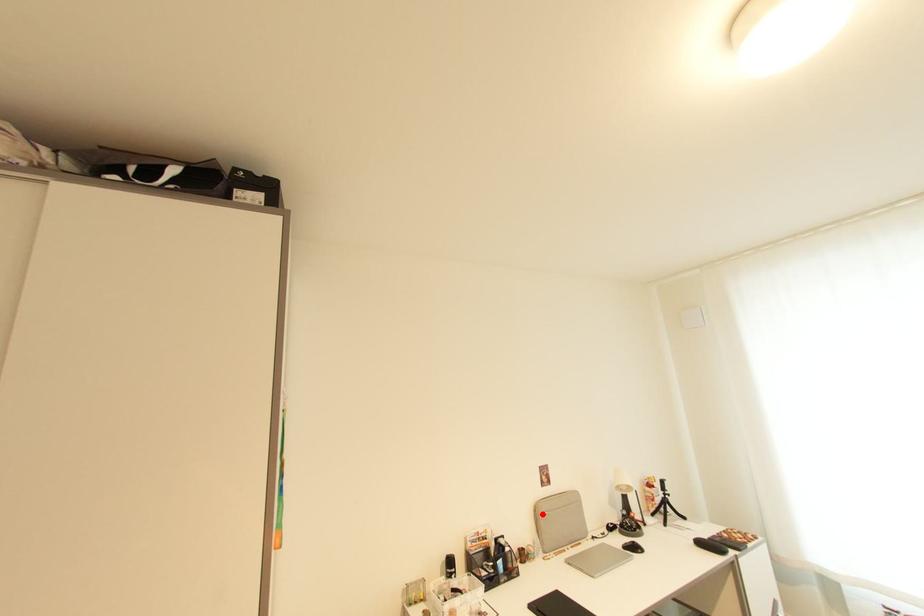
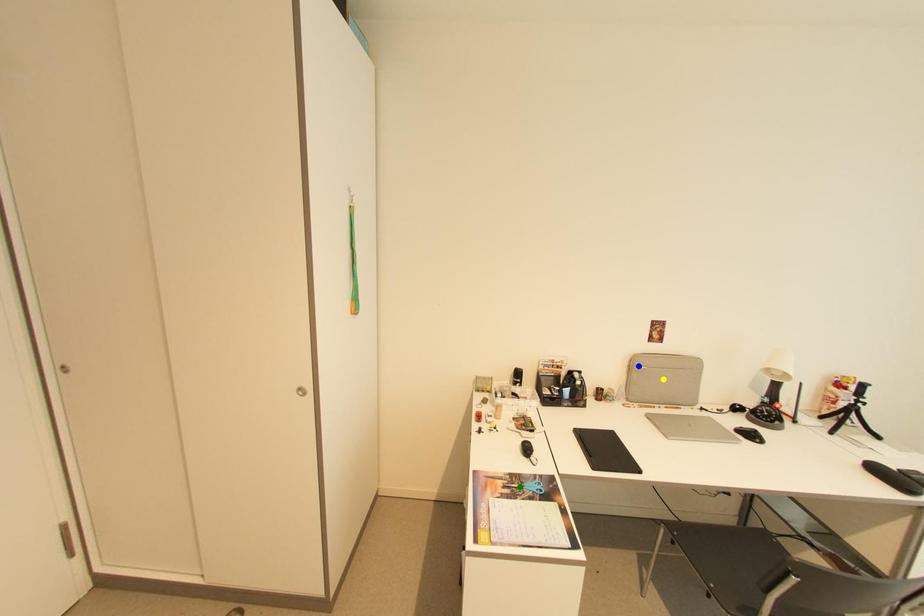
Question: I am providing you with two images of the same scene from different viewpoints. A red point is marked on the first image. You are given multiple points on the second image. In image 2, which mark is for the same physical point as the one in image 1?

Choices:
 (A) blue point
 (B) yellow point
 (C) green point

Answer: (A)